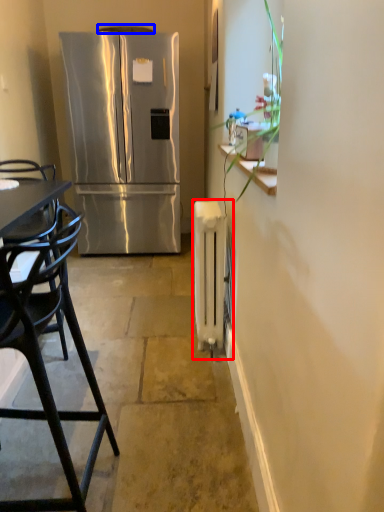
Question: Which of the following is the closest to the observer, radiator (highlighted by a red box) or exhaust hood (highlighted by a blue box)?

Choices:
 (A) radiator
 (B) exhaust hood

Answer: (A)